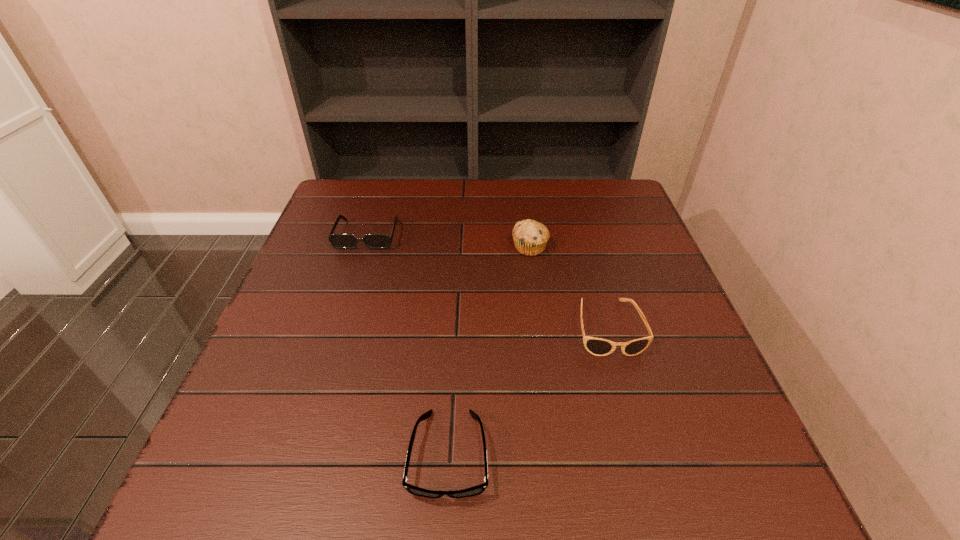
Identify the location of muffin. This screenshot has width=960, height=540. (530, 237).

Locate an element on the screen. Image resolution: width=960 pixels, height=540 pixels. the third object from left to right is located at coordinates (530, 237).

Find the location of `the leftmost object`. the leftmost object is located at coordinates (339, 241).

Find the location of `the farthest sunglasses`. the farthest sunglasses is located at coordinates (339, 241).

Find the location of a particular element. the rightmost sunglasses is located at coordinates (597, 346).

Identify the location of the rightmost object. Image resolution: width=960 pixels, height=540 pixels. (597, 346).

Where is `the second sunglasses from right to left`? The image size is (960, 540). the second sunglasses from right to left is located at coordinates (479, 489).

You are a GUI agent. You are given a task and a screenshot of the screen. Output one action in this format:
    pyautogui.click(x=<x>, y=<y>)
    Task: Click on the second object from left to right
    The image size is (960, 540).
    Given the screenshot: What is the action you would take?
    pyautogui.click(x=479, y=489)

I want to click on vacant space located 0.060m on the left of the muffin, so click(489, 247).

Where is `vacant position located 0.120m on the front-facing side of the leftmost object`? The width and height of the screenshot is (960, 540). vacant position located 0.120m on the front-facing side of the leftmost object is located at coordinates (352, 282).